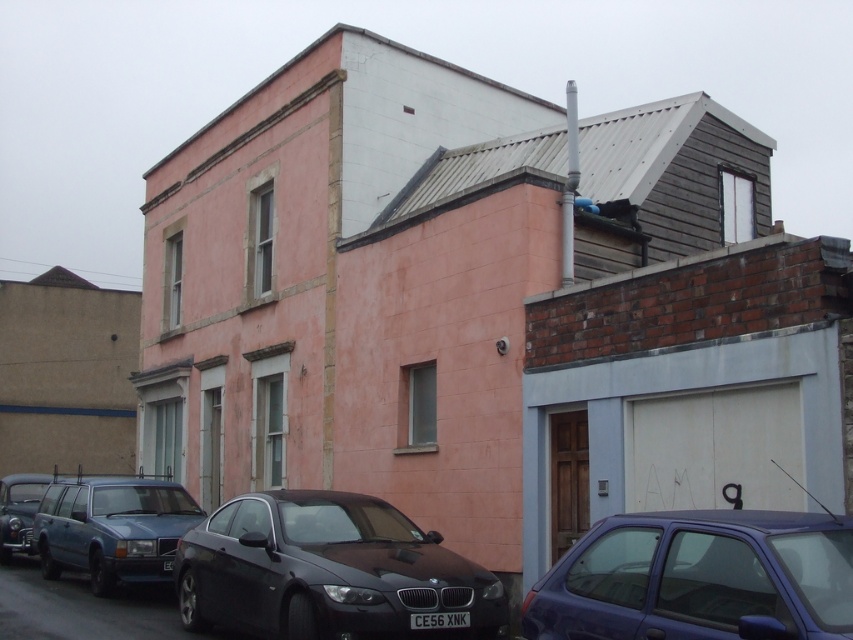
Question: Among these points, which one is nearest to the camera?

Choices:
 (A) (160, 500)
 (B) (825, 566)

Answer: (B)

Question: Observing the image, what is the correct spatial positioning of shiny black sedan at center in reference to metallic blue station wagon at left?

Choices:
 (A) left
 (B) right

Answer: (B)

Question: Can you confirm if metallic blue station wagon at left is positioned below shiny black car at lower left?

Choices:
 (A) no
 (B) yes

Answer: (A)

Question: Which of the following is the closest to the observer?

Choices:
 (A) pos(207,554)
 (B) pos(735,529)

Answer: (B)

Question: Can you confirm if shiny black sedan at center is thinner than metallic blue hatchback at lower right?

Choices:
 (A) no
 (B) yes

Answer: (A)

Question: Among these objects, which one is nearest to the camera?

Choices:
 (A) metallic blue hatchback at lower right
 (B) metallic blue station wagon at left
 (C) shiny black sedan at center
 (D) shiny black car at lower left

Answer: (A)